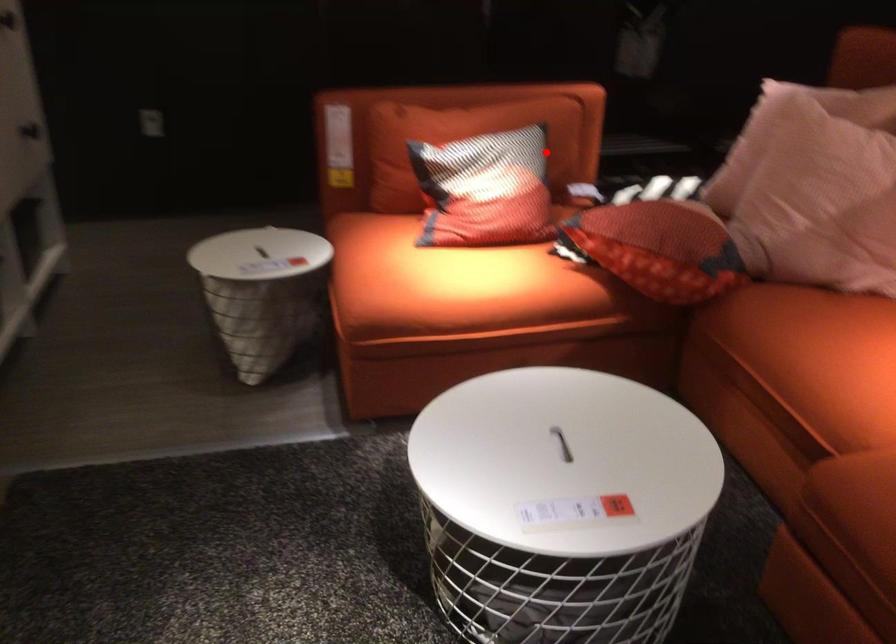
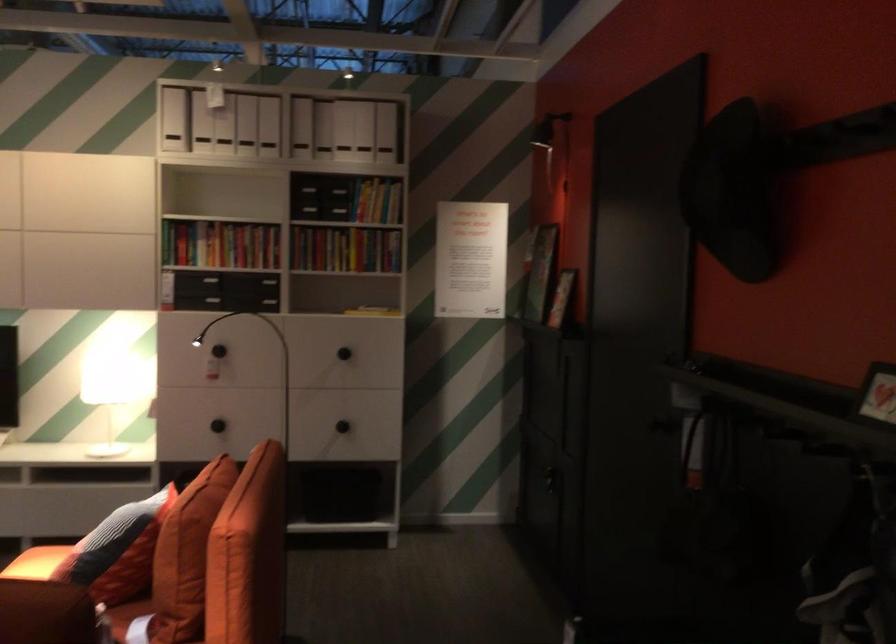
Question: I am providing you with two images of the same scene from different viewpoints. In image1, a red point is highlighted. Considering the same 3D point in image2, which of the following is correct?

Choices:
 (A) It is closer
 (B) It is farther

Answer: (A)